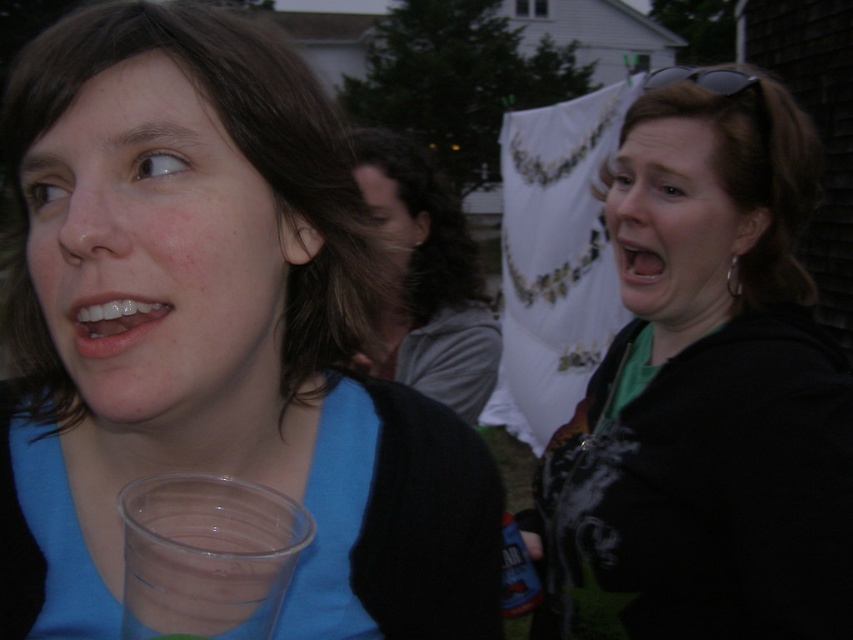
You are at a party and see the matte blue shirt at left and the white glossy teeth at lower left. Which object is taller?

The matte blue shirt at left is much taller than the white glossy teeth at lower left.